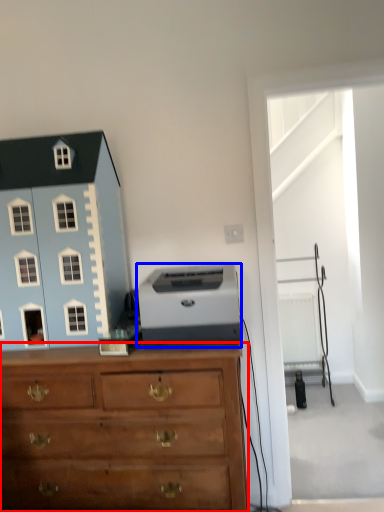
Question: Which object is closer to the camera taking this photo, chest of drawers (highlighted by a red box) or printer (highlighted by a blue box)?

Choices:
 (A) chest of drawers
 (B) printer

Answer: (A)